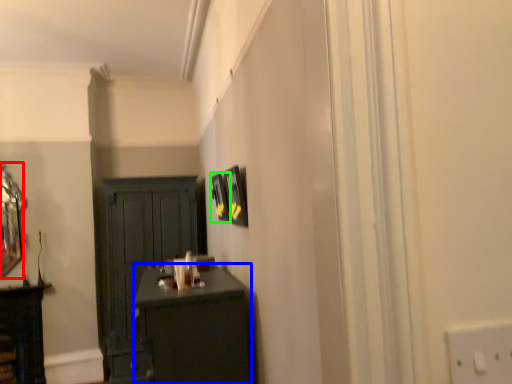
Question: Which object is positioned farthest from mirror (highlighted by a red box)? Select from desk (highlighted by a blue box) and picture frame (highlighted by a green box).

Choices:
 (A) desk
 (B) picture frame

Answer: (A)